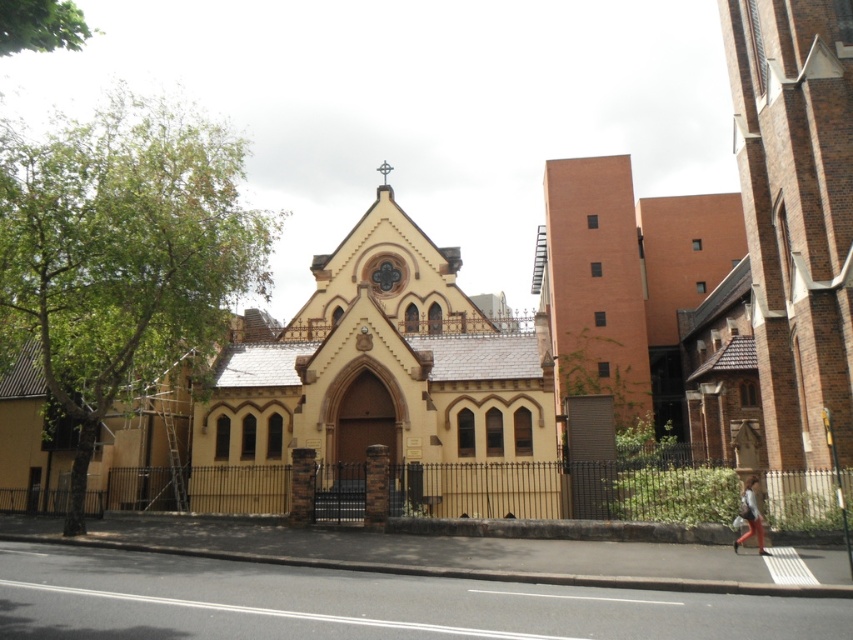
From the picture: Who is positioned more to the left, matte yellow chapel at center or denim pants at lower right?

matte yellow chapel at center is more to the left.

Does matte yellow chapel at center have a smaller size compared to denim pants at lower right?

No, matte yellow chapel at center is not smaller than denim pants at lower right.

What do you see at coordinates (380, 387) in the screenshot? The width and height of the screenshot is (853, 640). I see `matte yellow chapel at center` at bounding box center [380, 387].

At what (x,y) coordinates should I click in order to perform the action: click on matte yellow chapel at center. Please return your answer as a coordinate pair (x, y). This screenshot has height=640, width=853. Looking at the image, I should click on (380, 387).

How far apart are brick wall building at center and denim pants at lower right?

78.32 meters

Who is more distant from viewer, (642, 227) or (741, 540)?

Point (642, 227)

Where is `brick wall building at center`? brick wall building at center is located at coordinates (630, 285).

Between matte yellow chapel at center and brick wall building at center, which one appears on the right side from the viewer's perspective?

brick wall building at center is more to the right.

Does matte yellow chapel at center appear under brick wall building at center?

Yes.

Between point (329, 448) and point (659, 246), which one is positioned in front?

Point (329, 448) is more forward.

At what (x,y) coordinates should I click in order to perform the action: click on matte yellow chapel at center. Please return your answer as a coordinate pair (x, y). Looking at the image, I should click on (380, 387).